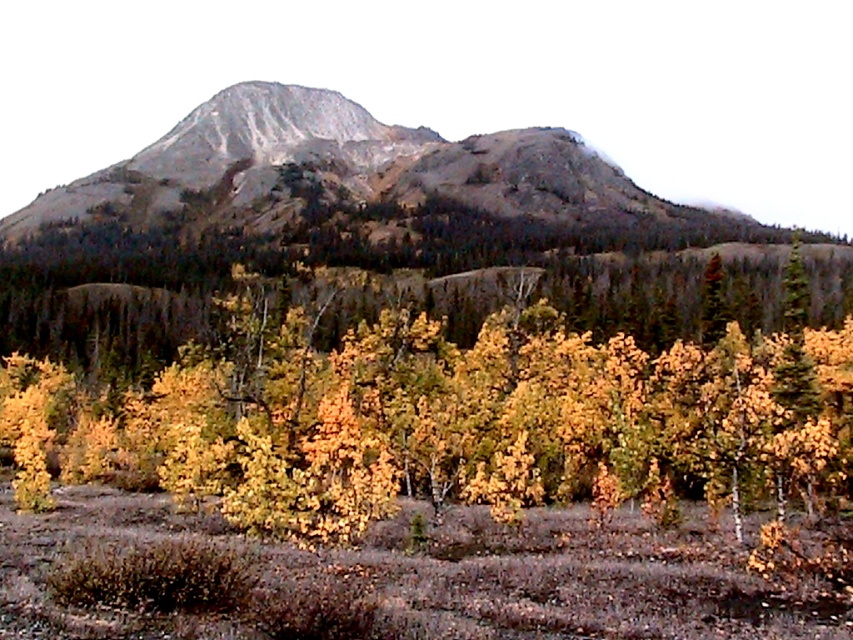
You are standing at the point marked by point (469,417) in the image. What direction should you walk to reach the yellow matte tree at center?

The point marked by point (469,417) is already at the yellow matte tree at center, so you are already there.

You are standing at the origin point of the coordinate system in the mountainous landscape. You want to place a small red flag exactly at the location of the yellow matte tree at center. What are the coordinates where you should place the flag?

The coordinates for placing the red flag at the location of the yellow matte tree at center are 0.652 in the x direction and 0.551 in the y direction.